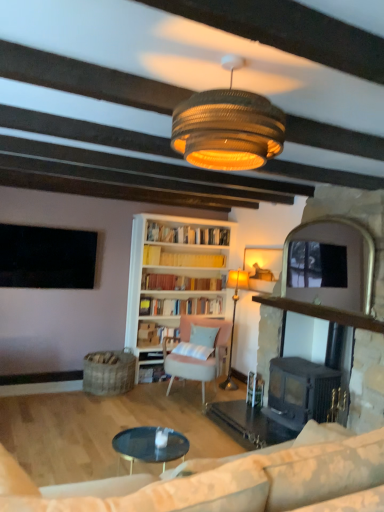
At what (x,y) coordinates should I click in order to perform the action: click on free space above braided wicker lampshade at center, the second lamp in the back-to-front sequence (from a real-world perspective). Please return your answer as a coordinate pair (x, y). Looking at the image, I should click on (232, 59).